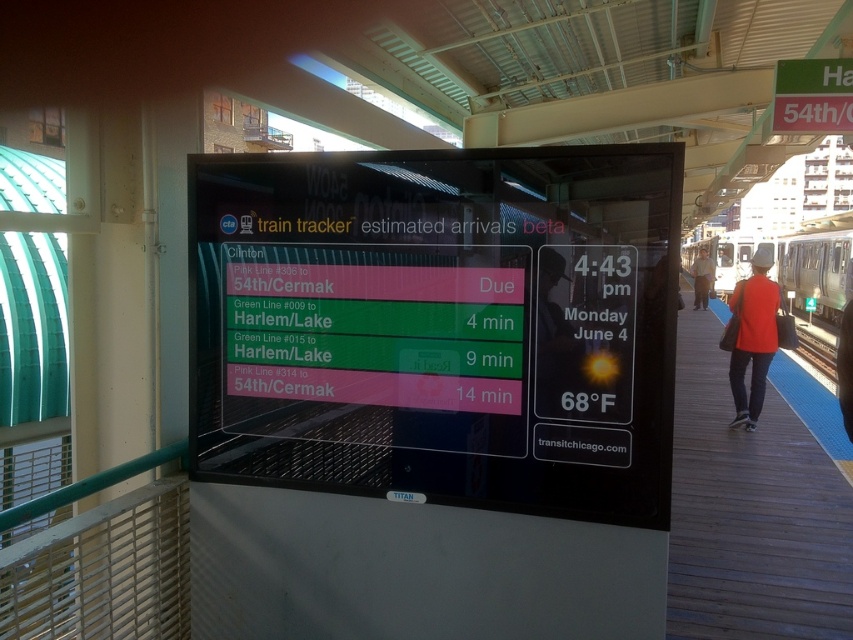
You are waiting at the CTA station platform and see the silver metallic train at right and the red shirt at right. Which object is more to the right?

The silver metallic train at right is more to the right than the red shirt at right.